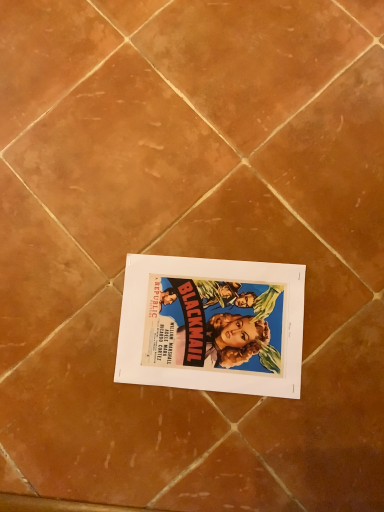
Describe the element at coordinates (212, 325) in the screenshot. The width and height of the screenshot is (384, 512). I see `matte paper poster at center` at that location.

At what (x,y) coordinates should I click in order to perform the action: click on matte paper poster at center. Please return your answer as a coordinate pair (x, y). This screenshot has height=512, width=384. Looking at the image, I should click on (212, 325).

What are the coordinates of `matte paper poster at center` in the screenshot? It's located at (212, 325).